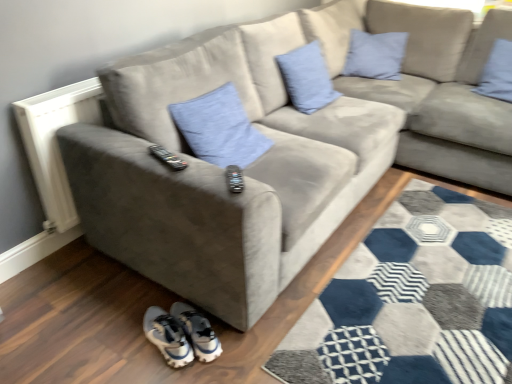
Question: Considering their positions, is blue fabric pillow at upper right, the 4th pillow when ordered from left to right, located in front of or behind blue linen pillow at upper center, which ranks as the second pillow in left-to-right order?

Choices:
 (A) behind
 (B) front

Answer: (A)

Question: Considering the positions of blue fabric pillow at upper right, the 4th pillow when ordered from left to right, and blue linen pillow at upper center, placed as the 3th pillow when sorted from right to left, in the image, is blue fabric pillow at upper right, the 4th pillow when ordered from left to right, wider or thinner than blue linen pillow at upper center, placed as the 3th pillow when sorted from right to left,?

Choices:
 (A) wide
 (B) thin

Answer: (B)

Question: Which object is positioned closest to the blue fabric pillow at center, the 1th pillow from the left?

Choices:
 (A) light blue fabric pillow at upper right, the third pillow in the left-to-right sequence
 (B) white synthetic sneakers at lower center
 (C) white textured radiator at left
 (D) blue fabric pillow at upper right, the 4th pillow when ordered from left to right
 (E) blue linen pillow at upper center, placed as the 3th pillow when sorted from right to left

Answer: (C)

Question: Considering the real-world distances, which object is closest to the light blue fabric pillow at upper right, which is the second pillow from right to left?

Choices:
 (A) white synthetic sneakers at lower center
 (B) blue linen pillow at upper center, placed as the 3th pillow when sorted from right to left
 (C) blue fabric pillow at upper right, which is counted as the first pillow, starting from the right
 (D) blue fabric pillow at center, the 1th pillow from the left
 (E) white textured radiator at left

Answer: (B)